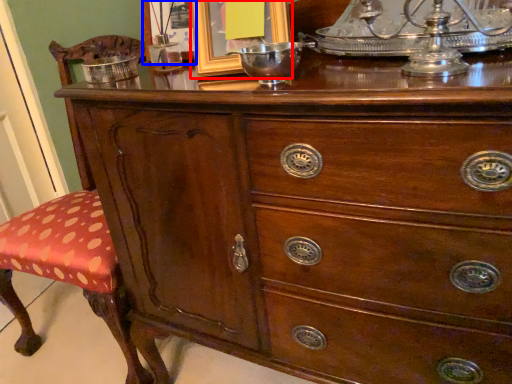
Question: Which point is further to the camera, picture frame (highlighted by a red box) or picture frame (highlighted by a blue box)?

Choices:
 (A) picture frame
 (B) picture frame

Answer: (B)